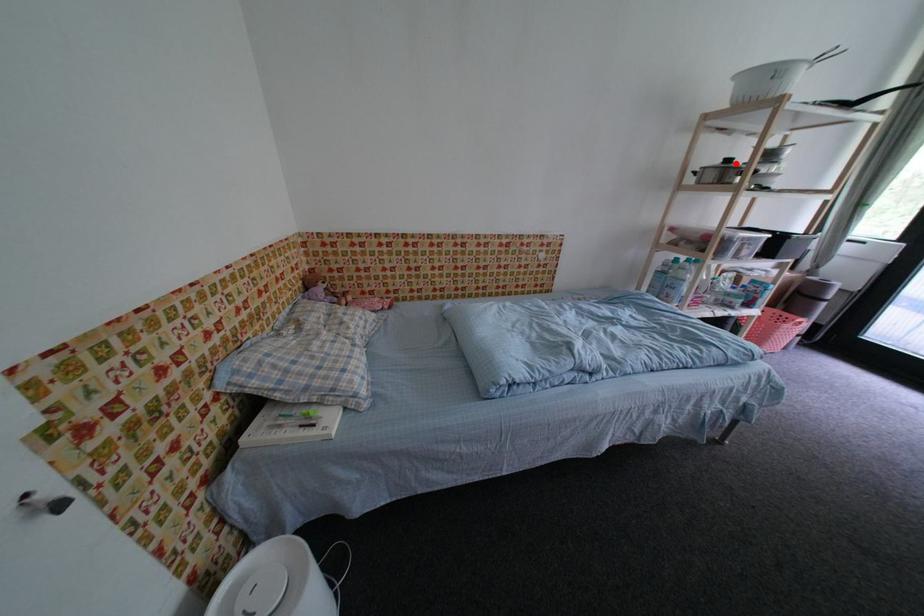
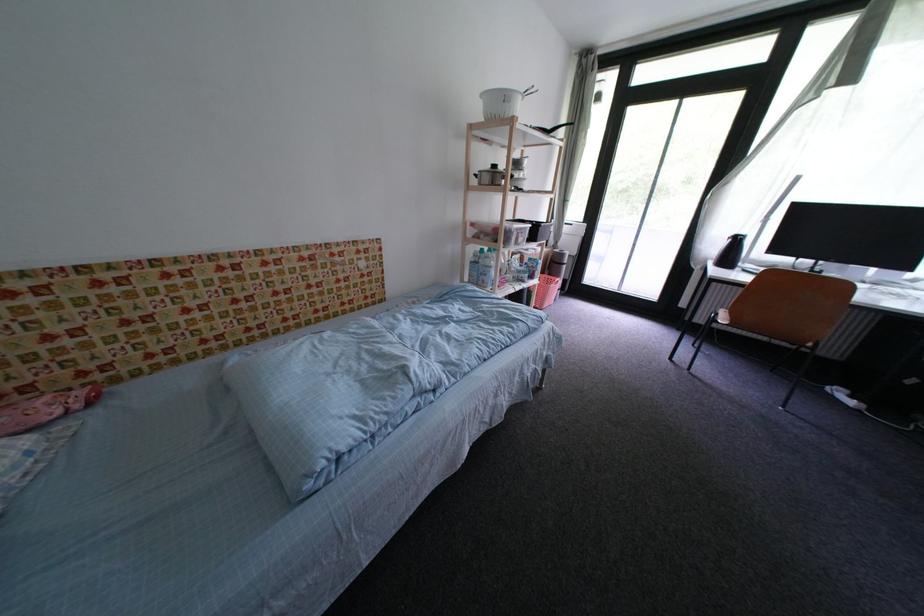
In the second image, find the point that corresponds to the highlighted location in the first image.

(503, 169)